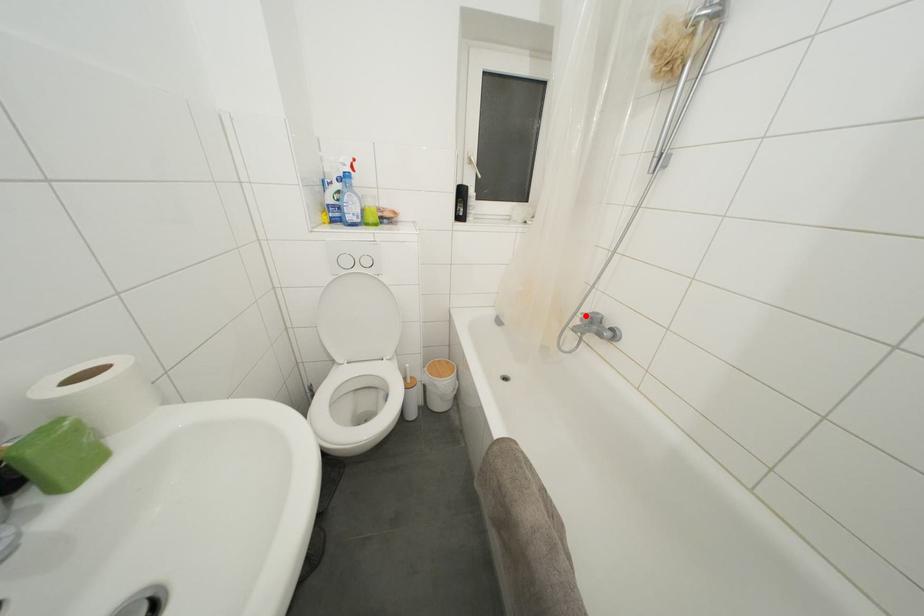
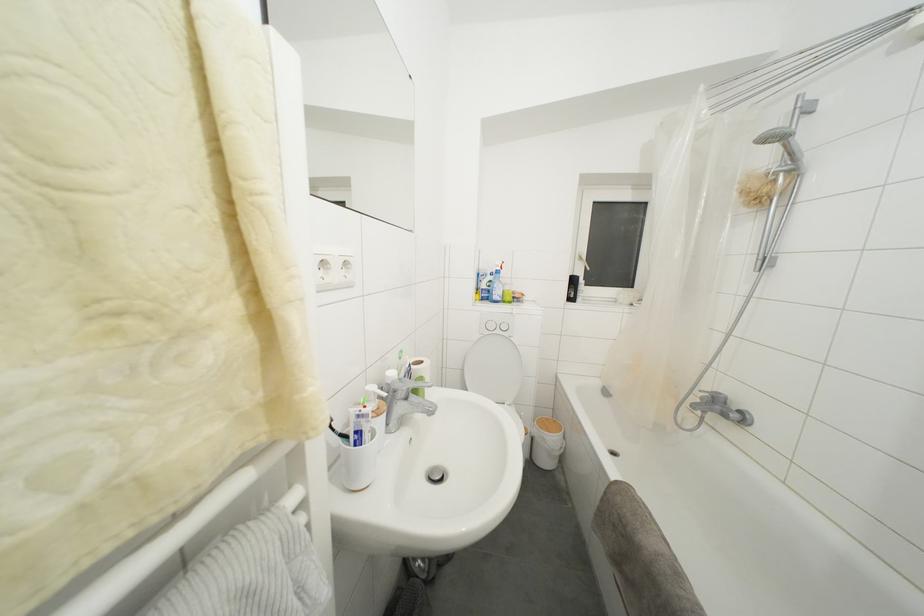
Question: I am providing you with two images of the same scene from different viewpoints. A red point is shown in image1. For the corresponding object point in image2, is it positioned nearer or farther from the camera?

Choices:
 (A) Nearer
 (B) Farther

Answer: (B)